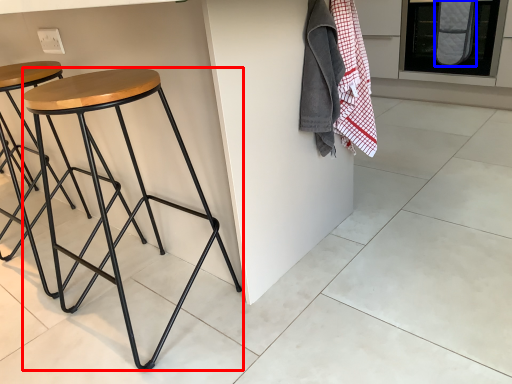
Question: Which object appears closest to the camera in this image, stool (highlighted by a red box) or blanket (highlighted by a blue box)?

Choices:
 (A) stool
 (B) blanket

Answer: (A)